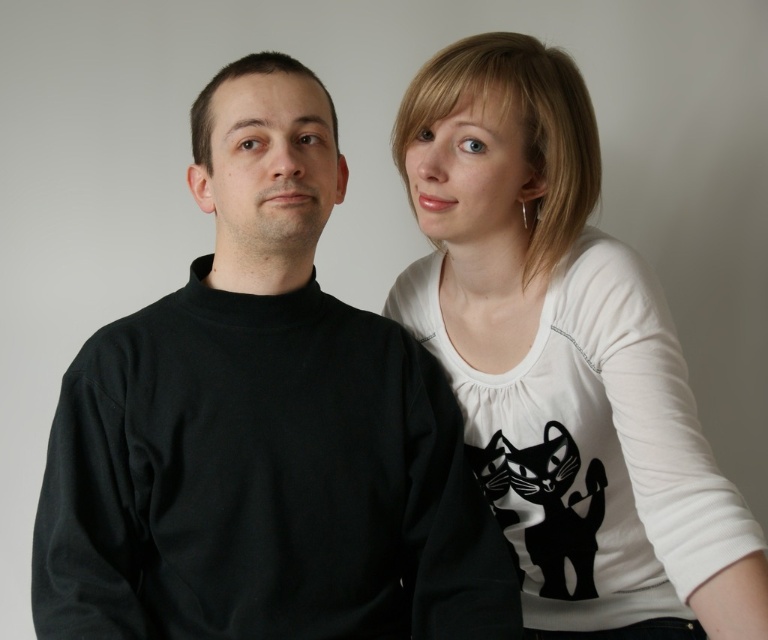
Looking at this image, can you confirm if black matte turtleneck sweater at left is shorter than white matte shirt at upper right?

Correct, black matte turtleneck sweater at left is not as tall as white matte shirt at upper right.

Is black matte turtleneck sweater at left above white matte shirt at upper right?

Correct, black matte turtleneck sweater at left is located above white matte shirt at upper right.

Which is behind, point (303, 68) or point (732, 504)?

The point (303, 68) is behind.

Where is `black matte turtleneck sweater at left`? The width and height of the screenshot is (768, 640). black matte turtleneck sweater at left is located at coordinates pos(262,428).